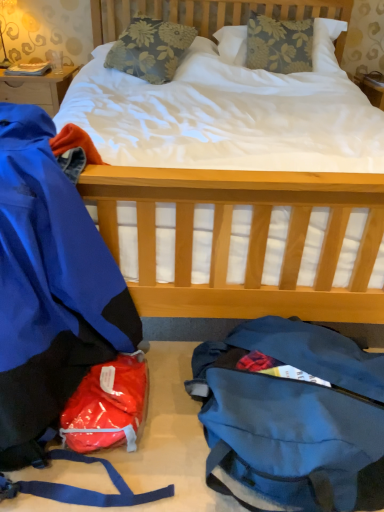
Question: Can you confirm if wooden desk at upper left is thinner than floral fabric pillow at center, the 1th pillow when ordered from left to right?

Choices:
 (A) yes
 (B) no

Answer: (A)

Question: Is wooden desk at upper left to the right of floral fabric pillow at center, positioned as the second pillow in right-to-left order, from the viewer's perspective?

Choices:
 (A) yes
 (B) no

Answer: (B)

Question: Would you say floral fabric pillow at center, the 1th pillow when ordered from left to right, is part of wooden desk at upper left's contents?

Choices:
 (A) yes
 (B) no

Answer: (B)

Question: Is wooden desk at upper left positioned with its back to floral fabric pillow at center, positioned as the second pillow in right-to-left order?

Choices:
 (A) no
 (B) yes

Answer: (A)

Question: Is wooden desk at upper left touching floral fabric pillow at center, the 1th pillow when ordered from left to right?

Choices:
 (A) yes
 (B) no

Answer: (B)

Question: Does wooden desk at upper left appear on the left side of floral fabric pillow at center, positioned as the second pillow in right-to-left order?

Choices:
 (A) no
 (B) yes

Answer: (B)

Question: Considering the relative positions of floral fabric pillow at center, positioned as the second pillow in right-to-left order, and shiny plastic bag at lower left in the image provided, is floral fabric pillow at center, positioned as the second pillow in right-to-left order, to the left of shiny plastic bag at lower left from the viewer's perspective?

Choices:
 (A) no
 (B) yes

Answer: (A)

Question: Can you confirm if floral fabric pillow at center, positioned as the second pillow in right-to-left order, is shorter than shiny plastic bag at lower left?

Choices:
 (A) yes
 (B) no

Answer: (B)

Question: From the image's perspective, is floral fabric pillow at center, positioned as the second pillow in right-to-left order, over shiny plastic bag at lower left?

Choices:
 (A) no
 (B) yes

Answer: (B)

Question: Can you confirm if floral fabric pillow at center, the 1th pillow when ordered from left to right, is wider than shiny plastic bag at lower left?

Choices:
 (A) no
 (B) yes

Answer: (B)

Question: Is floral fabric pillow at center, the 1th pillow when ordered from left to right, turned away from shiny plastic bag at lower left?

Choices:
 (A) yes
 (B) no

Answer: (B)

Question: Can you confirm if floral fabric pillow at center, the 1th pillow when ordered from left to right, is bigger than shiny plastic bag at lower left?

Choices:
 (A) yes
 (B) no

Answer: (A)

Question: From a real-world perspective, does blue waterproof jacket at left stand above floral fabric pillow at upper center, the first pillow positioned from the right?

Choices:
 (A) no
 (B) yes

Answer: (A)